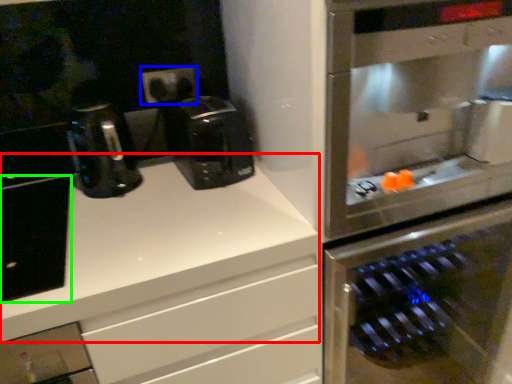
Question: Which object is the farthest from counter top (highlighted by a red box)? Choose among these: electric outlet (highlighted by a blue box) or cabinetry (highlighted by a green box).

Choices:
 (A) electric outlet
 (B) cabinetry

Answer: (A)